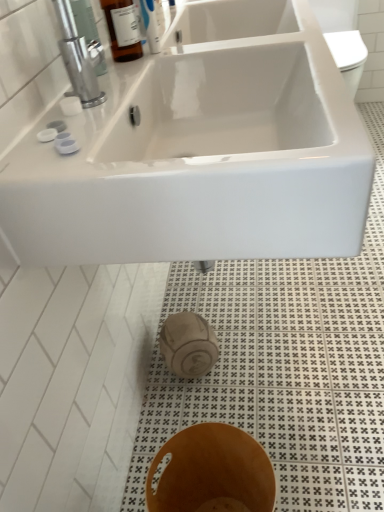
Question: Is metallic silver faucet at upper left smaller than brown wood bidet at lower center?

Choices:
 (A) yes
 (B) no

Answer: (A)

Question: From the image's perspective, would you say metallic silver faucet at upper left is positioned over brown wood bidet at lower center?

Choices:
 (A) yes
 (B) no

Answer: (A)

Question: Can you confirm if metallic silver faucet at upper left is taller than brown wood bidet at lower center?

Choices:
 (A) no
 (B) yes

Answer: (A)

Question: Is metallic silver faucet at upper left positioned before brown wood bidet at lower center?

Choices:
 (A) yes
 (B) no

Answer: (B)

Question: Can you see metallic silver faucet at upper left touching brown wood bidet at lower center?

Choices:
 (A) no
 (B) yes

Answer: (A)

Question: Relative to white glossy sink at upper center, is brown wood bidet at lower center in front or behind?

Choices:
 (A) behind
 (B) front

Answer: (A)

Question: From the image's perspective, relative to white glossy sink at upper center, is brown wood bidet at lower center above or below?

Choices:
 (A) below
 (B) above

Answer: (A)

Question: Looking at the image, does brown wood bidet at lower center seem bigger or smaller compared to white glossy sink at upper center?

Choices:
 (A) big
 (B) small

Answer: (B)

Question: Does point (236, 470) appear closer or farther from the camera than point (359, 216)?

Choices:
 (A) closer
 (B) farther

Answer: (B)

Question: Is point (62, 35) closer or farther from the camera than point (200, 434)?

Choices:
 (A) closer
 (B) farther

Answer: (A)

Question: Considering their positions, is metallic silver faucet at upper left located in front of or behind brown wood bidet at lower center?

Choices:
 (A) front
 (B) behind

Answer: (B)

Question: Looking at the image, does metallic silver faucet at upper left seem bigger or smaller compared to brown wood bidet at lower center?

Choices:
 (A) big
 (B) small

Answer: (B)

Question: Considering the positions of metallic silver faucet at upper left and brown wood bidet at lower center in the image, is metallic silver faucet at upper left taller or shorter than brown wood bidet at lower center?

Choices:
 (A) tall
 (B) short

Answer: (B)

Question: Looking at their shapes, would you say metallic silver faucet at upper left is wider or thinner than white glossy sink at upper center?

Choices:
 (A) wide
 (B) thin

Answer: (B)

Question: Is point (69, 14) closer or farther from the camera than point (235, 51)?

Choices:
 (A) closer
 (B) farther

Answer: (A)